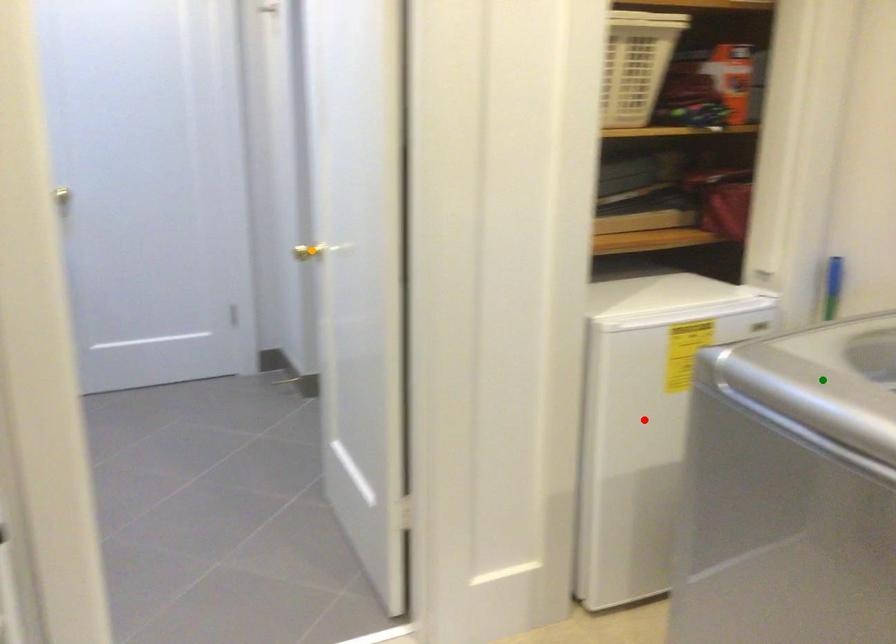
Order these from nearest to farthest:
A) green point
B) orange point
C) red point

orange point
red point
green point